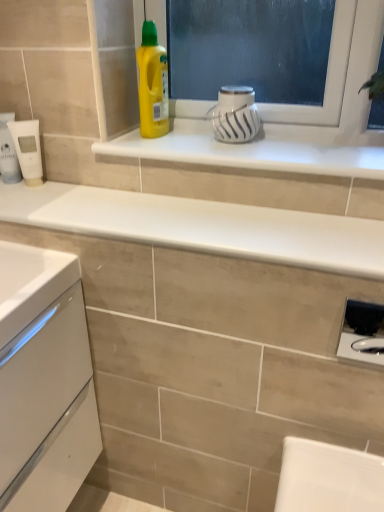
Question: Does yellow plastic bottle at upper center appear on the left side of white glossy mug at upper center, which is the 2th appliance in left-to-right order?

Choices:
 (A) no
 (B) yes

Answer: (B)

Question: From a real-world perspective, is yellow plastic bottle at upper center on white glossy mug at upper center, acting as the third appliance starting from the bottom?

Choices:
 (A) no
 (B) yes

Answer: (B)

Question: Is yellow plastic bottle at upper center taller than white glossy mug at upper center, which is the 2th appliance in left-to-right order?

Choices:
 (A) yes
 (B) no

Answer: (A)

Question: Does yellow plastic bottle at upper center have a smaller size compared to white glossy mug at upper center, the 2th appliance positioned from the right?

Choices:
 (A) yes
 (B) no

Answer: (B)

Question: Is yellow plastic bottle at upper center positioned beyond the bounds of white glossy mug at upper center, acting as the third appliance starting from the bottom?

Choices:
 (A) yes
 (B) no

Answer: (A)

Question: Considering their positions, is yellow plastic bottle at upper center located in front of or behind white matte tube at left, placed as the first appliance when sorted from left to right?

Choices:
 (A) behind
 (B) front

Answer: (B)

Question: Is point (168, 122) positioned closer to the camera than point (26, 120)?

Choices:
 (A) closer
 (B) farther

Answer: (B)

Question: Considering the positions of yellow plastic bottle at upper center and white matte tube at left, the 2th appliance when ordered from top to bottom, in the image, is yellow plastic bottle at upper center taller or shorter than white matte tube at left, the 2th appliance when ordered from top to bottom,?

Choices:
 (A) tall
 (B) short

Answer: (A)

Question: Is yellow plastic bottle at upper center to the left or to the right of white matte tube at left, acting as the second appliance starting from the bottom, in the image?

Choices:
 (A) left
 (B) right

Answer: (B)

Question: Based on their positions, is satin black soap dispenser at lower right, which appears as the 1th appliance when viewed from the right, located to the left or right of yellow plastic bottle at upper center?

Choices:
 (A) left
 (B) right

Answer: (B)

Question: From a real-world perspective, is satin black soap dispenser at lower right, the first appliance from the front, physically located above or below yellow plastic bottle at upper center?

Choices:
 (A) above
 (B) below

Answer: (B)

Question: Considering the positions of satin black soap dispenser at lower right, which appears as the 1th appliance when viewed from the right, and yellow plastic bottle at upper center in the image, is satin black soap dispenser at lower right, which appears as the 1th appliance when viewed from the right, taller or shorter than yellow plastic bottle at upper center?

Choices:
 (A) tall
 (B) short

Answer: (B)

Question: From the image's perspective, relative to yellow plastic bottle at upper center, is satin black soap dispenser at lower right, which appears as the 1th appliance when viewed from the right, above or below?

Choices:
 (A) above
 (B) below

Answer: (B)

Question: Is point (104, 231) positioned closer to the camera than point (162, 102)?

Choices:
 (A) farther
 (B) closer

Answer: (B)

Question: From their relative heights in the image, would you say white glossy countertop at upper center is taller or shorter than yellow plastic bottle at upper center?

Choices:
 (A) short
 (B) tall

Answer: (A)